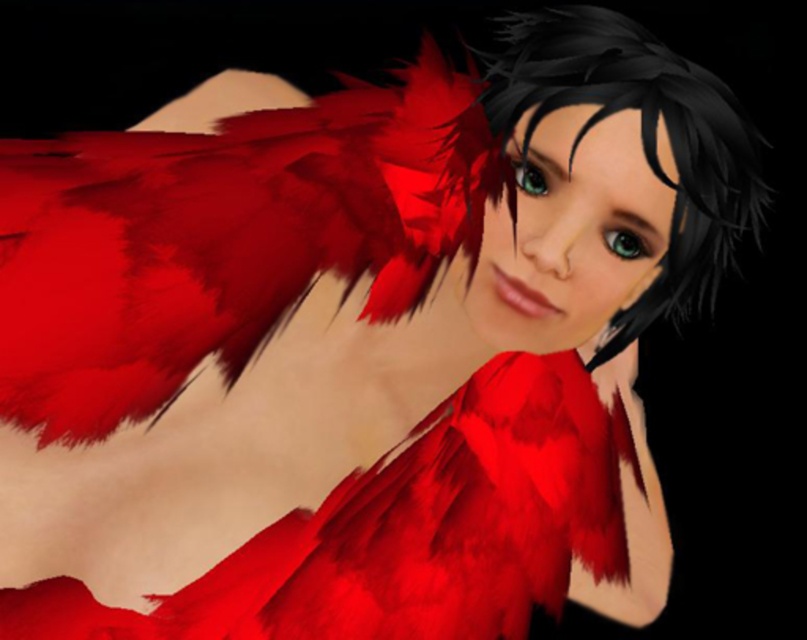
Question: Among these points, which one is nearest to the camera?

Choices:
 (A) (588, 28)
 (B) (341, 576)

Answer: (A)

Question: Which point is farther from the camera taking this photo?

Choices:
 (A) (668, 60)
 (B) (536, 428)

Answer: (B)

Question: Is velvet-like red dress at center below black matte hair at upper center?

Choices:
 (A) yes
 (B) no

Answer: (A)

Question: Does velvet-like red dress at center appear under black matte hair at upper center?

Choices:
 (A) no
 (B) yes

Answer: (B)

Question: Is velvet-like red dress at center to the right of black matte hair at upper center from the viewer's perspective?

Choices:
 (A) no
 (B) yes

Answer: (A)

Question: Which object appears farthest from the camera in this image?

Choices:
 (A) velvet-like red dress at center
 (B) black matte hair at upper center

Answer: (A)